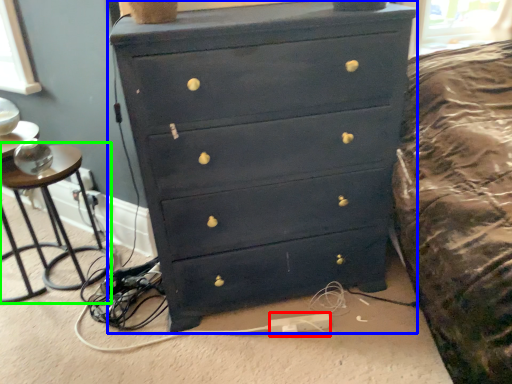
Question: Considering the real-world distances, which object is farthest from extension cord (highlighted by a red box)? chest of drawers (highlighted by a blue box) or side table (highlighted by a green box)?

Choices:
 (A) chest of drawers
 (B) side table

Answer: (B)